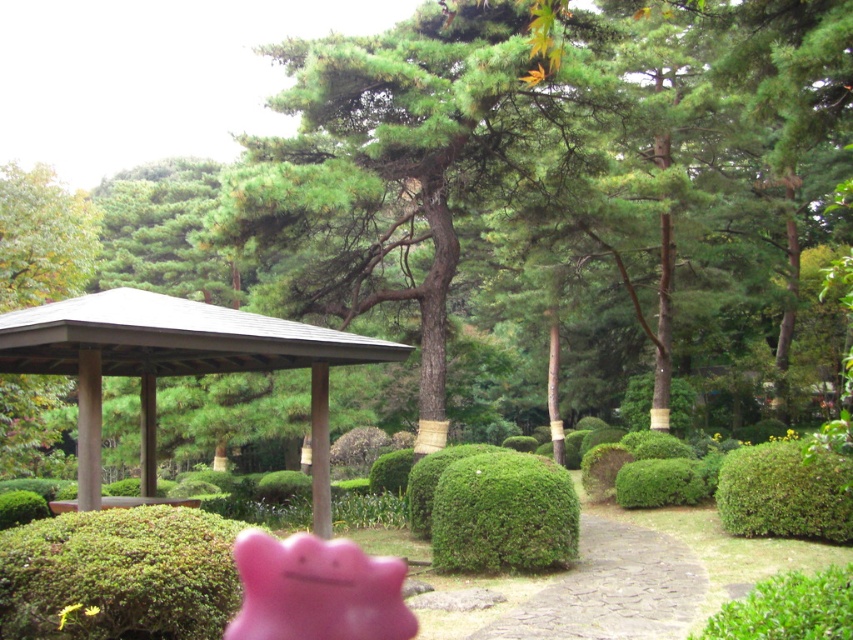
Who is taller, green matte hedge at center or green textured hedge at center right?

With more height is green textured hedge at center right.

Who is shorter, green matte hedge at center or green textured hedge at center right?

green matte hedge at center is shorter.

What do you see at coordinates (503, 515) in the screenshot?
I see `green matte hedge at center` at bounding box center [503, 515].

This screenshot has height=640, width=853. What are the coordinates of `green matte hedge at center` in the screenshot? It's located at (503, 515).

Which of these two, green matte hedge at lower left or pink rubber toy at center, stands shorter?

With less height is green matte hedge at lower left.

Is green matte hedge at lower left closer to the viewer compared to pink rubber toy at center?

Yes, green matte hedge at lower left is in front of pink rubber toy at center.

The height and width of the screenshot is (640, 853). I want to click on green matte hedge at lower left, so click(x=119, y=573).

Where is `green matte hedge at lower left`? This screenshot has height=640, width=853. green matte hedge at lower left is located at coordinates pyautogui.click(x=119, y=573).

Does brown wooden gazebo at center appear on the left side of pink rubber toy at center?

Yes, brown wooden gazebo at center is to the left of pink rubber toy at center.

Which is more to the left, brown wooden gazebo at center or pink rubber toy at center?

brown wooden gazebo at center

You are a GUI agent. You are given a task and a screenshot of the screen. Output one action in this format:
    pyautogui.click(x=<x>, y=<y>)
    Task: Click on the brown wooden gazebo at center
    This screenshot has height=640, width=853.
    Given the screenshot: What is the action you would take?
    pyautogui.click(x=173, y=365)